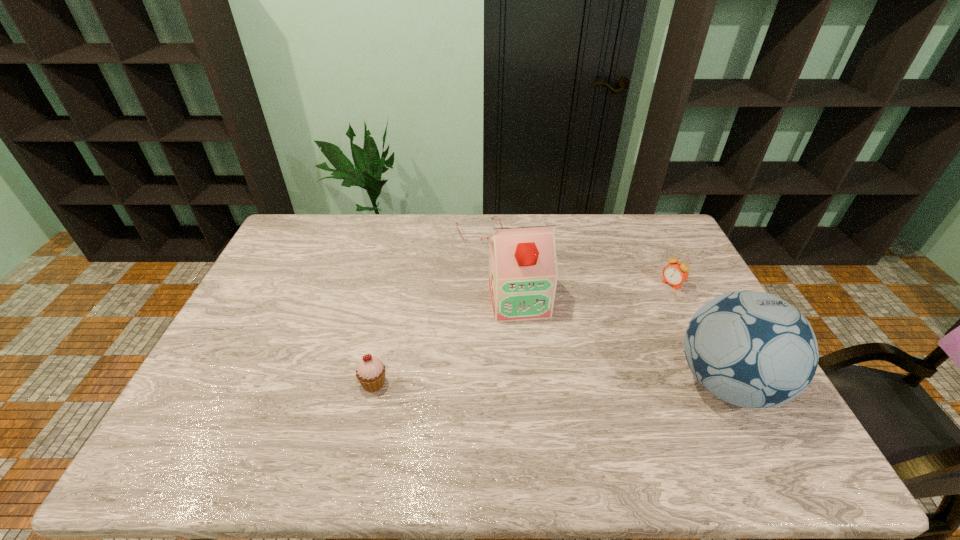
You are a GUI agent. You are given a task and a screenshot of the screen. Output one action in this format:
    pyautogui.click(x=<x>, y=<y>)
    Task: Click on the blank space located 0.320m on the face of the alarm clock
    
    Given the screenshot: What is the action you would take?
    pyautogui.click(x=600, y=335)

Locate an element on the screen. Image resolution: width=960 pixels, height=540 pixels. blank area located 0.110m on the face of the alarm clock is located at coordinates (644, 303).

This screenshot has height=540, width=960. Find the location of `vacant space located on the face of the alarm clock`. vacant space located on the face of the alarm clock is located at coordinates (624, 318).

The image size is (960, 540). I want to click on vacant space located on the lenses of the shortest object, so click(x=512, y=301).

At what (x,y) coordinates should I click in order to perform the action: click on free space located 0.280m on the lenses of the shortest object. Please return your answer as a coordinate pair (x, y). The height and width of the screenshot is (540, 960). Looking at the image, I should click on (510, 297).

This screenshot has width=960, height=540. In order to click on vacant region located 0.330m on the lenses of the shortest object in this screenshot , I will do `click(516, 308)`.

Locate an element on the screen. The width and height of the screenshot is (960, 540). object that is at the far edge is located at coordinates (473, 240).

At what (x,y) coordinates should I click in order to perform the action: click on cupcake positioned at the near edge. Please return your answer as a coordinate pair (x, y). Looking at the image, I should click on click(370, 372).

What are the coordinates of `soccer ball that is at the near edge` in the screenshot? It's located at (752, 349).

Find the location of a particular element. The width and height of the screenshot is (960, 540). soccer ball positioned at the right edge is located at coordinates (x=752, y=349).